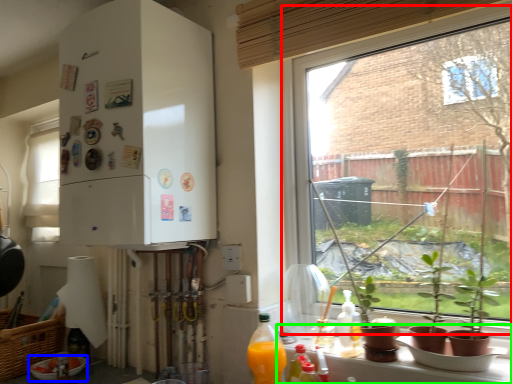
Question: Based on their relative distances, which object is nearer to window (highlighted by a red box)? Choose from bowl (highlighted by a blue box) and window sill (highlighted by a green box).

Choices:
 (A) bowl
 (B) window sill

Answer: (B)